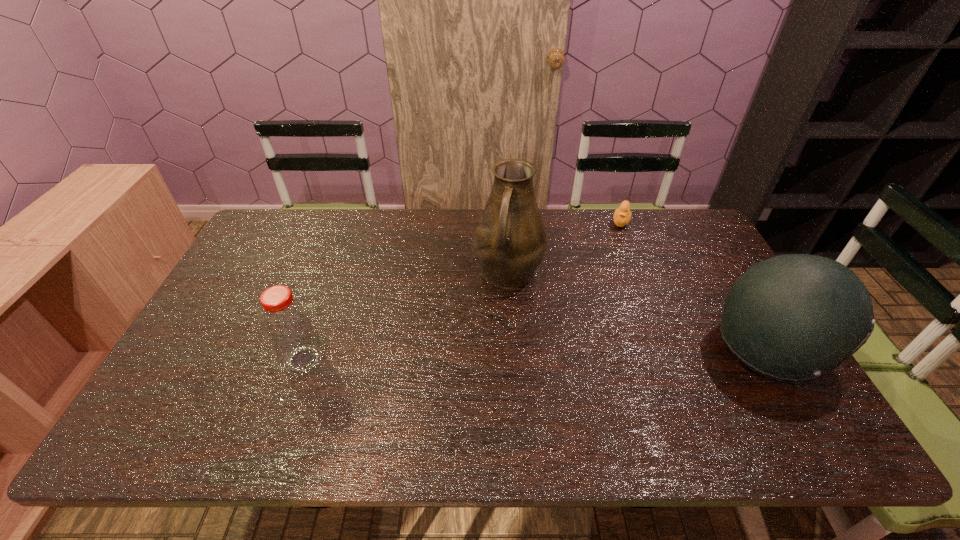
Identify the location of free spot that satisfies the following two spatial constraints: 1. on the back side of the bottle; 2. on the left side of the shortest object. (353, 221).

Identify the location of vacant space that satisfies the following two spatial constraints: 1. on the front side of the shortest object; 2. at the face opening of the second tallest object. This screenshot has height=540, width=960. (671, 349).

The width and height of the screenshot is (960, 540). Find the location of `free region that satisfies the following two spatial constraints: 1. on the front side of the pitcher; 2. at the face opening of the third shortest object`. free region that satisfies the following two spatial constraints: 1. on the front side of the pitcher; 2. at the face opening of the third shortest object is located at coordinates (514, 349).

You are a GUI agent. You are given a task and a screenshot of the screen. Output one action in this format:
    pyautogui.click(x=<x>, y=<y>)
    Task: Click on the vacant space that satisfies the following two spatial constraints: 1. on the front side of the football helmet; 2. at the face opening of the duckling
    Image resolution: width=960 pixels, height=540 pixels.
    Given the screenshot: What is the action you would take?
    pyautogui.click(x=671, y=349)